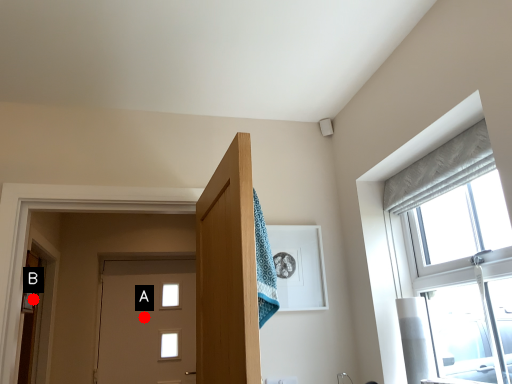
Question: Two points are circled on the image, labeled by A and B beside each circle. Among these points, which one is farthest from the camera?

Choices:
 (A) A is further
 (B) B is further

Answer: (A)